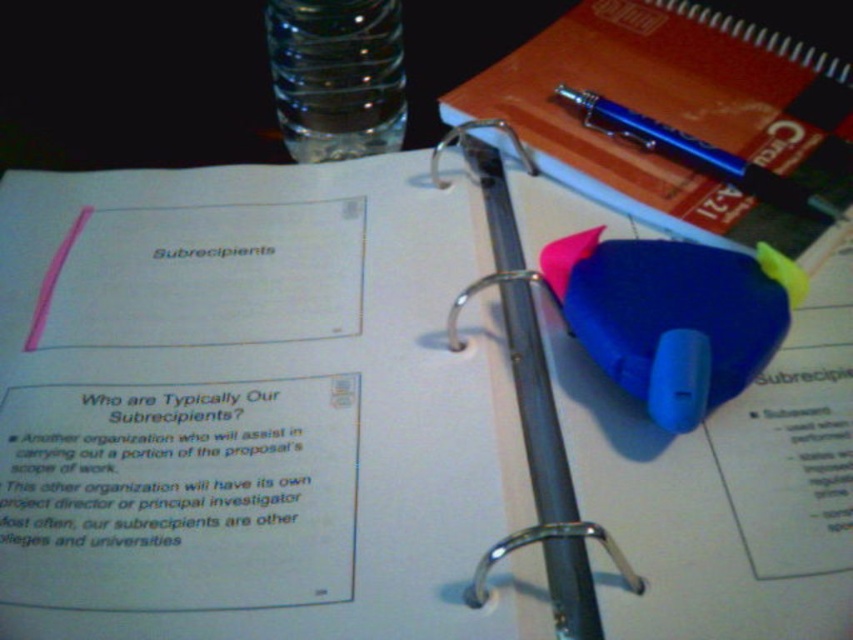
You have two blue pens on your desk. The blue plastic pen at center and the blue metallic pen at upper right. Which one is thinner?

The blue plastic pen at center is thinner than the blue metallic pen at upper right.

You are organizing your desk and need to place a new item exactly where the orange matte notepad at upper right is currently located. According to the image, what are the coordinates of the spot where you should place the new item?

The coordinates for the orange matte notepad at upper right are at point (x=674, y=120), so you should place the new item there.

You are organizing a stationery set and need to place the blue plastic pen at center and the blue metallic pen at upper right into a vertical pen holder. The holder can only accommodate pens up to 12 cm in height. Which pen should you place first to ensure both fit?

The blue plastic pen at center has a greater height compared to the blue metallic pen at upper right. To ensure both fit in the vertical pen holder, place the taller blue plastic pen at center first, then the shorter blue metallic pen at upper right.